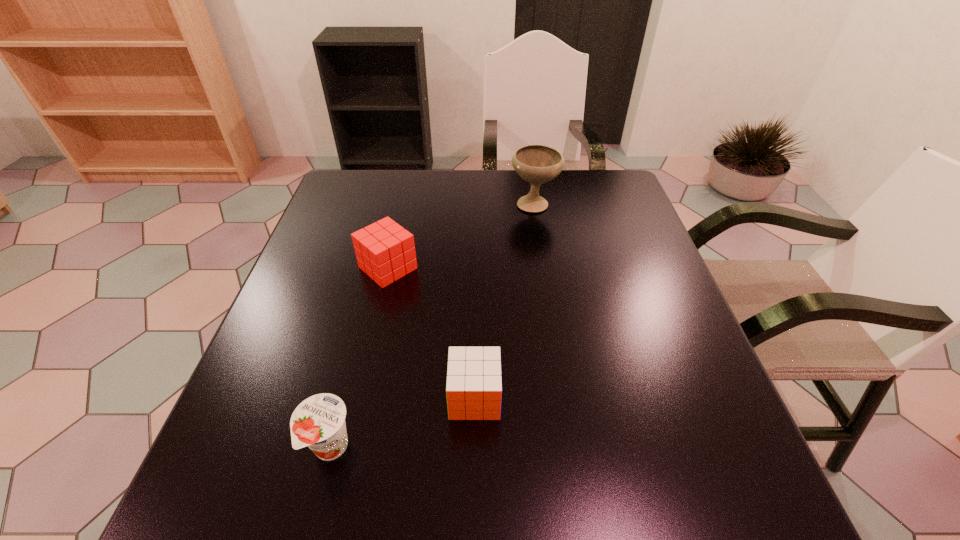
The height and width of the screenshot is (540, 960). Identify the location of free space at the far right corner. pos(619,204).

Identify the location of vacant space at the near right corner of the desktop. (757, 492).

Locate an element on the screen. free spot between the nearest object and the nearer cube is located at coordinates (402, 423).

This screenshot has height=540, width=960. What are the coordinates of `free space between the farthest object and the nearest object` in the screenshot? It's located at (432, 326).

Locate an element on the screen. Image resolution: width=960 pixels, height=540 pixels. empty location between the nearest object and the left cube is located at coordinates (359, 358).

At what (x,y) coordinates should I click in order to perform the action: click on empty space that is in between the nearest object and the tallest object. Please return your answer as a coordinate pair (x, y). The height and width of the screenshot is (540, 960). Looking at the image, I should click on (432, 326).

Find the location of a particular element. The width and height of the screenshot is (960, 540). free point between the nearest object and the third nearest object is located at coordinates (359, 358).

Where is `free space between the right cube and the second farthest object`? free space between the right cube and the second farthest object is located at coordinates (431, 333).

The image size is (960, 540). What are the coordinates of `free space between the nearer cube and the farther cube` in the screenshot? It's located at (431, 333).

Locate an element on the screen. This screenshot has height=540, width=960. free space between the yogurt and the chalice is located at coordinates (432, 326).